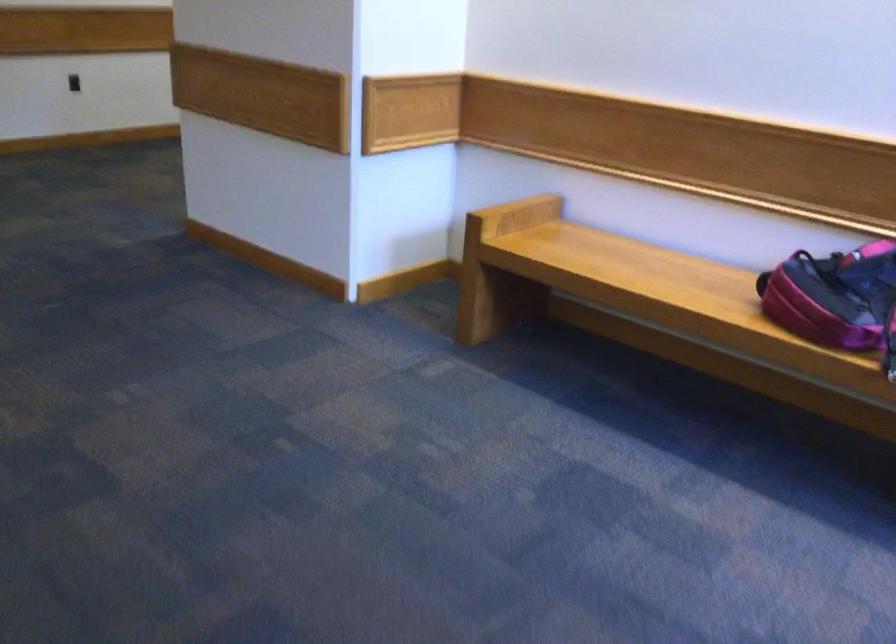
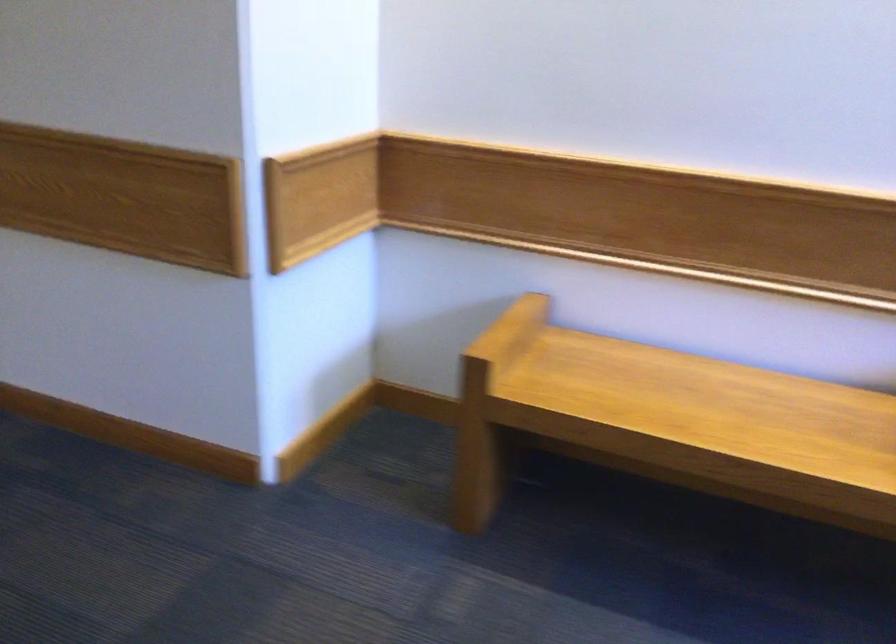
In a continuous first-person perspective shot, in which direction is the camera moving?

The cameraman moved toward left, forward.